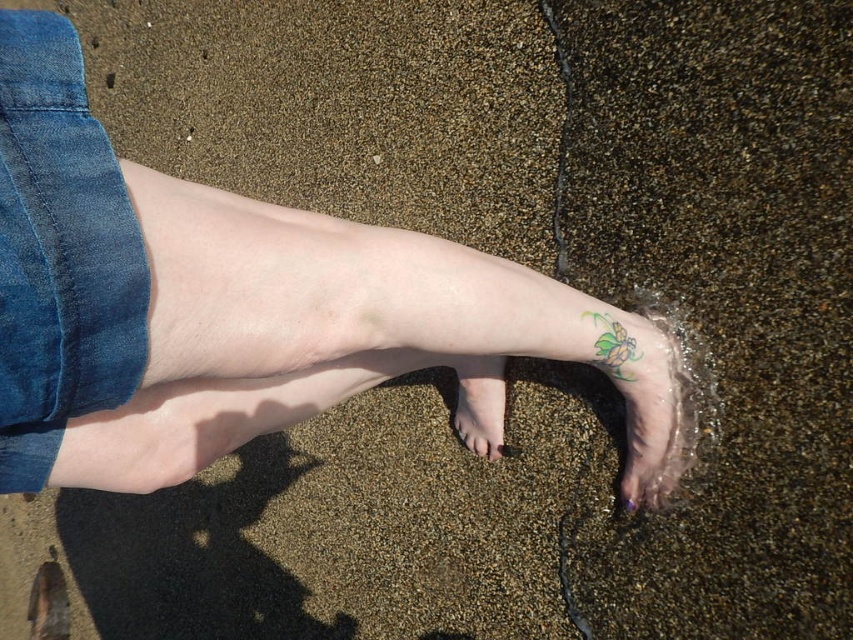
Question: From the image, what is the correct spatial relationship of pale skin foot at lower center in relation to purple glossy toe at lower center?

Choices:
 (A) below
 (B) above

Answer: (B)

Question: From the image, what is the correct spatial relationship of pale skin foot at lower center in relation to matte skin toe at lower center?

Choices:
 (A) left
 (B) right

Answer: (A)

Question: Is green matte butterfly at lower right thinner than matte skin toe at lower center?

Choices:
 (A) yes
 (B) no

Answer: (B)

Question: Which of the following is the closest to the observer?

Choices:
 (A) pale skin foot at lower center
 (B) purple glossy toe at lower center
 (C) multicolored tattooed foot at lower right

Answer: (C)

Question: Which point appears farthest from the camera in this image?

Choices:
 (A) (665, 362)
 (B) (599, 356)
 (C) (492, 444)
 (D) (627, 506)

Answer: (C)

Question: Which point is closer to the camera?

Choices:
 (A) (485, 356)
 (B) (636, 346)

Answer: (B)